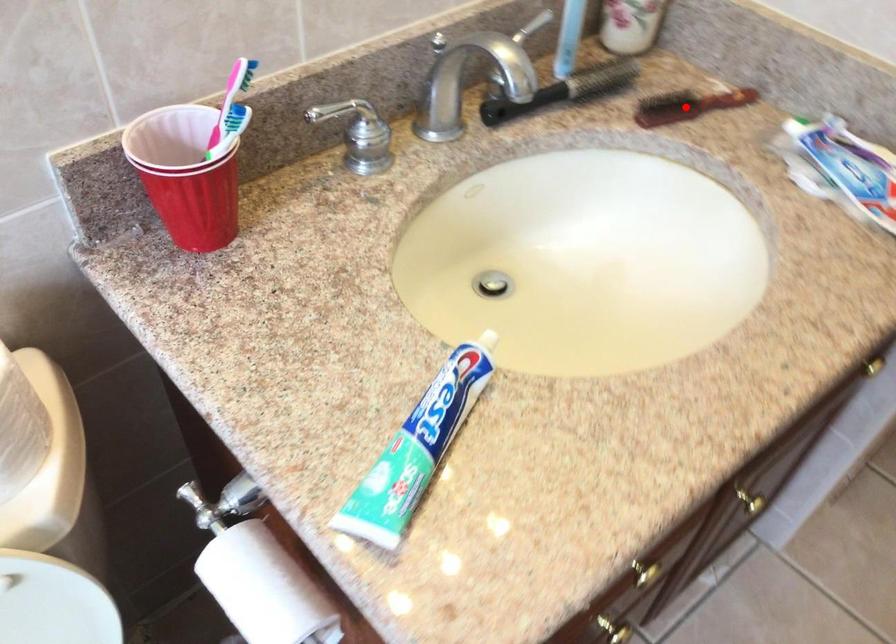
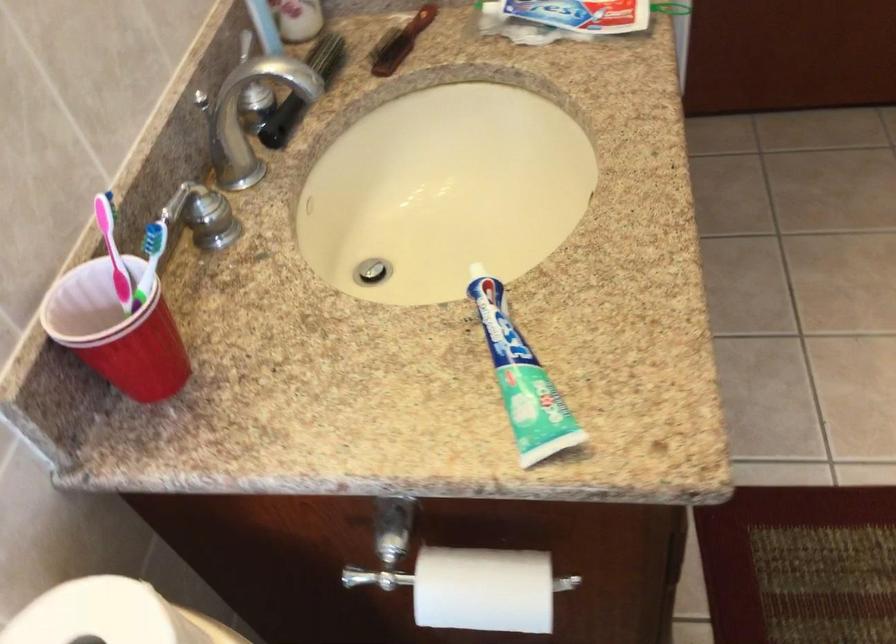
Question: I am providing you with two images of the same scene from different viewpoints. In image1, a red point is highlighted. Considering the same 3D point in image2, which of the following is correct?

Choices:
 (A) It is closer
 (B) It is farther

Answer: (B)